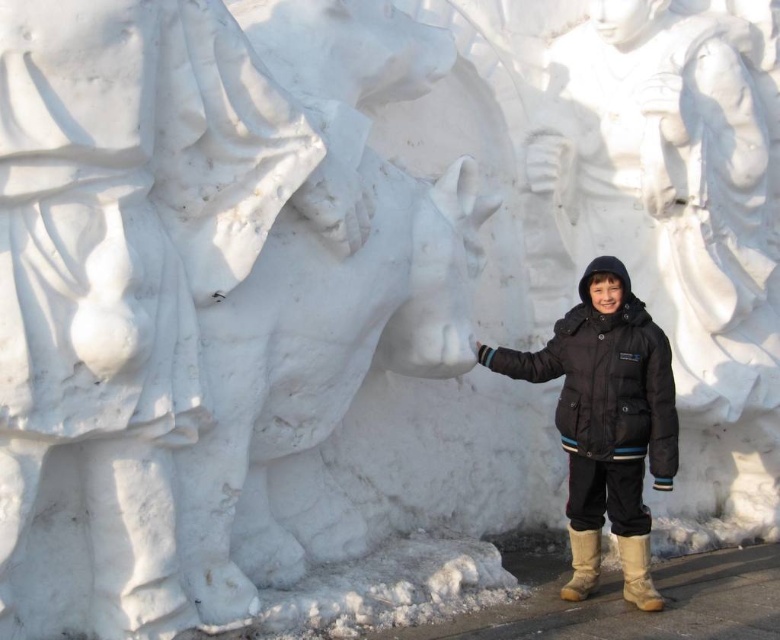
In the scene shown: You are a photographer trying to capture the white marble statue at center and the black matte jacket at center in the same frame. Based on their positions, which object should you focus on first to ensure both are in focus?

The white marble statue at center is located above the black matte jacket at center, so you should focus on the white marble statue at center first to ensure both are in focus.

You are a tour guide leading a group of visitors. You want to ensure that everyone can see the white marble statue at center clearly from their current position. What is the minimum distance you should maintain between the visitors and the statue to ensure visibility?

The white marble statue at center is 16.58 feet from viewer. To ensure clear visibility, visitors should be positioned at least 16.58 feet away from the statue.

You are a photographer trying to capture the white marble statue at center and the brown suede boot at lower right in a single frame. Based on their positions, can you fit both into your camera viewfinder without moving either object?

The white marble statue at center might be wider than brown suede boot at lower right, but since their exact widths aren not specified, it is uncertain if they can both fit in the frame. Adjust your angle or zoom to ensure both are visible.